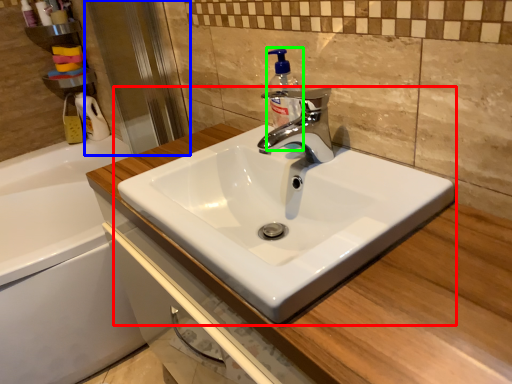
Question: Which is nearer to the sink (highlighted by a red box)? screen door (highlighted by a blue box) or soap dispenser (highlighted by a green box).

Choices:
 (A) screen door
 (B) soap dispenser

Answer: (B)